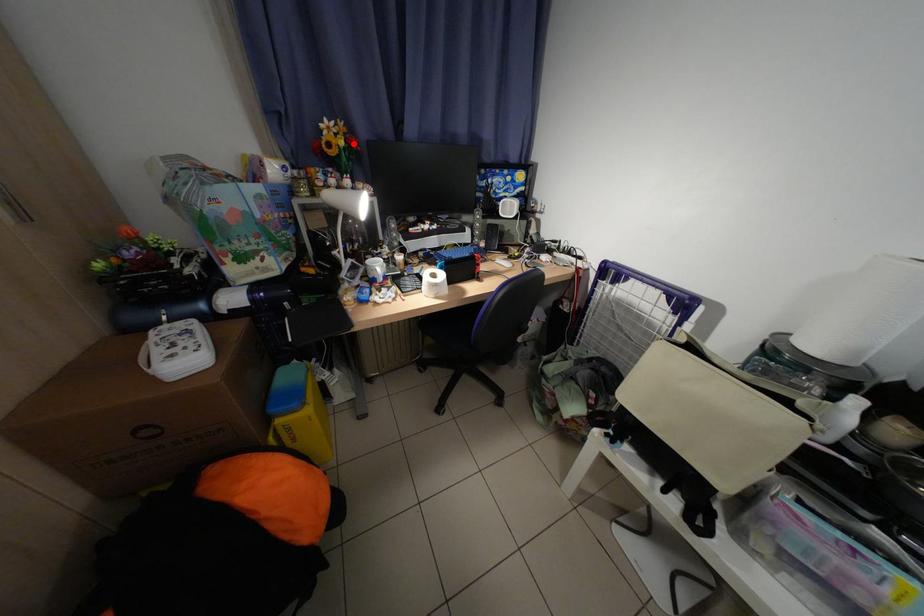
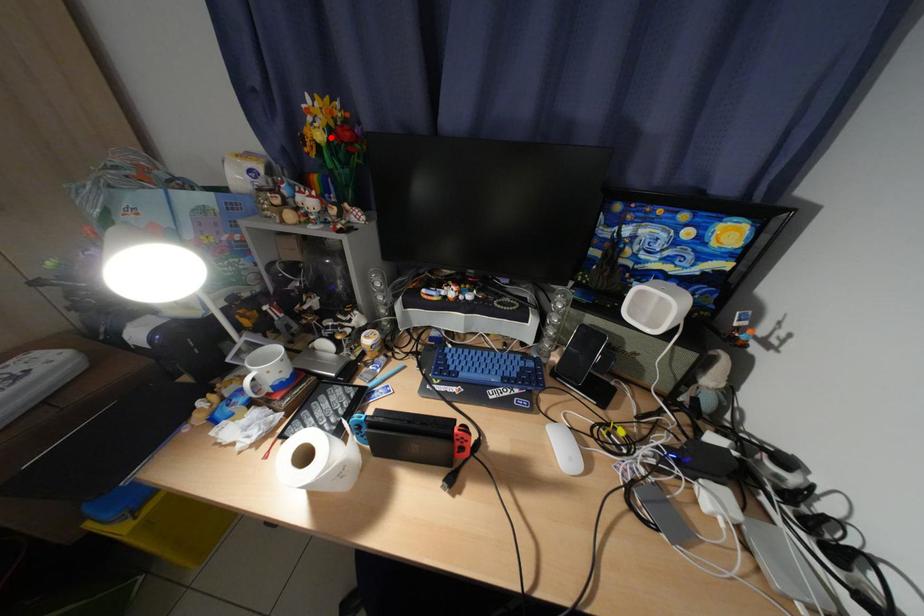
I am providing you with two images of the same scene from different viewpoints. A red point is marked on the first image and another point is marked on the second image. Do the highlighted points in image1 and image2 indicate the same real-world spot?

Yes